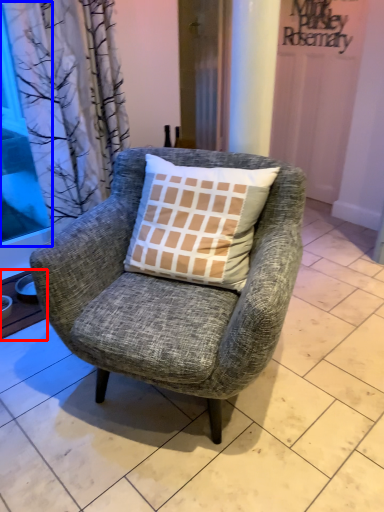
Question: Which of the following is the closest to the observer, window sill (highlighted by a red box) or window screen (highlighted by a blue box)?

Choices:
 (A) window sill
 (B) window screen

Answer: (B)